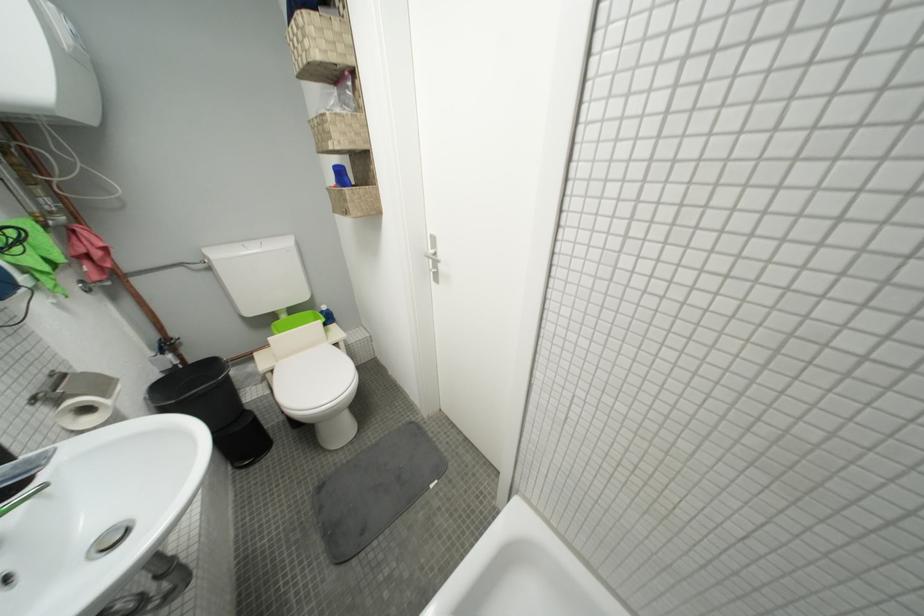
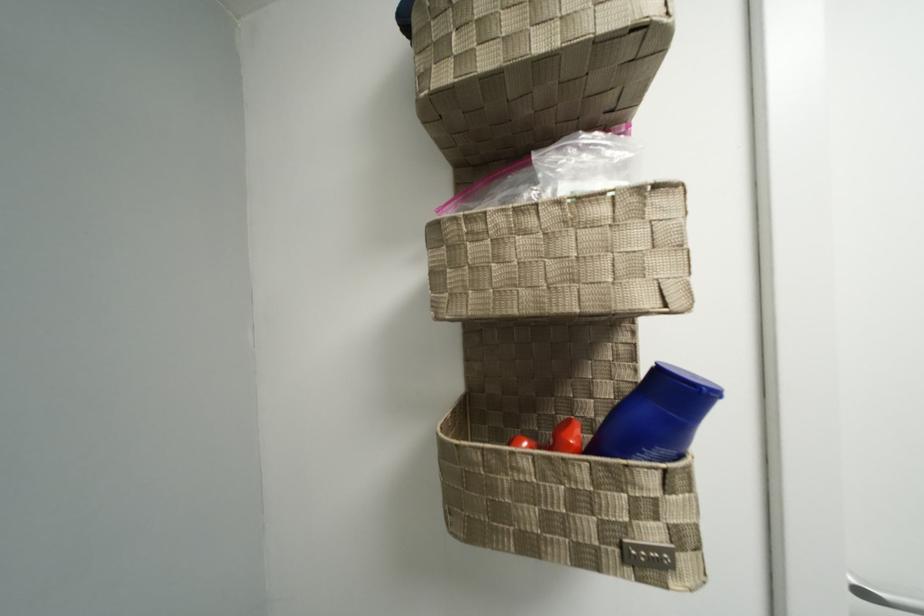
Find the pixel in the second image that matches (x=343, y=185) in the first image.

(689, 450)